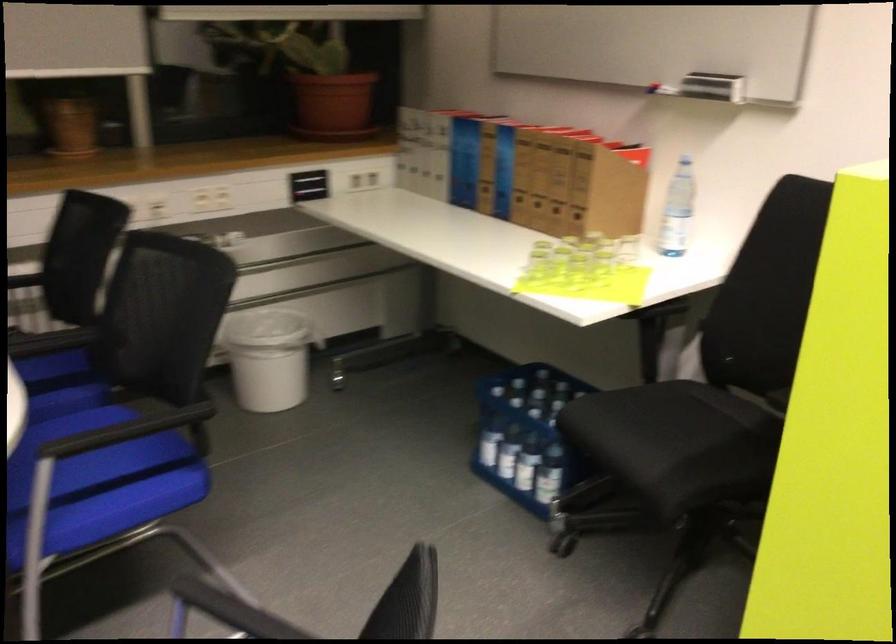
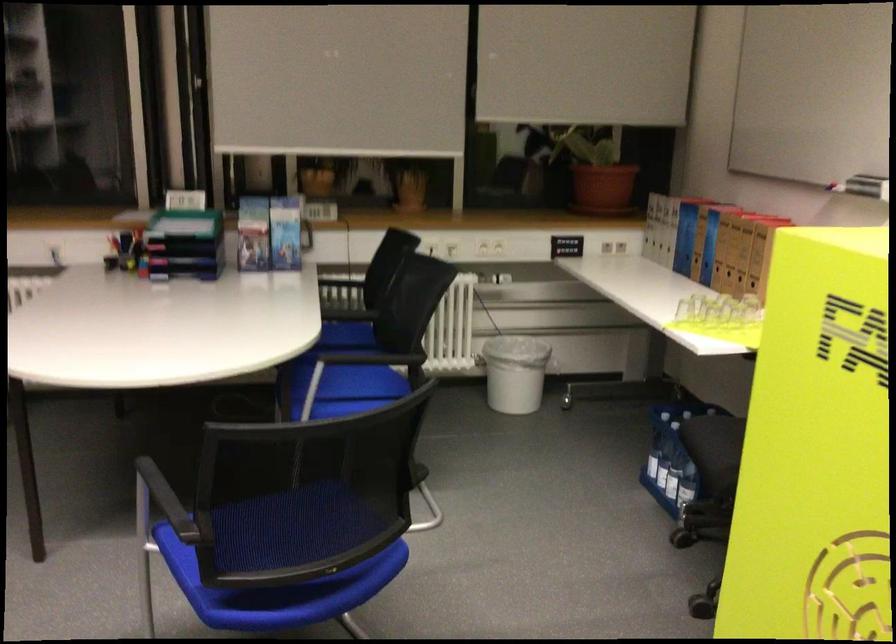
In the second image, find the point that corresponds to the point at 487,444 in the first image.

(650, 458)